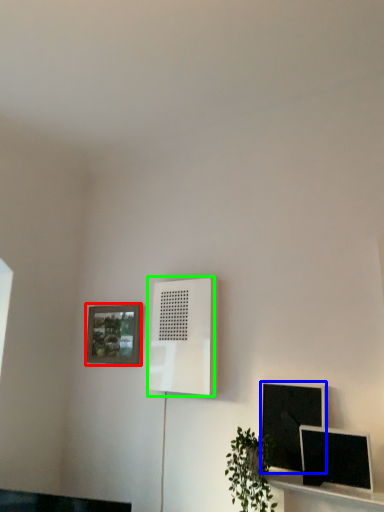
Question: Estimate the real-world distances between objects in this image. Which object is farther from picture frame (highlighted by a red box), computer monitor (highlighted by a blue box) or air conditioner (highlighted by a green box)?

Choices:
 (A) computer monitor
 (B) air conditioner

Answer: (A)